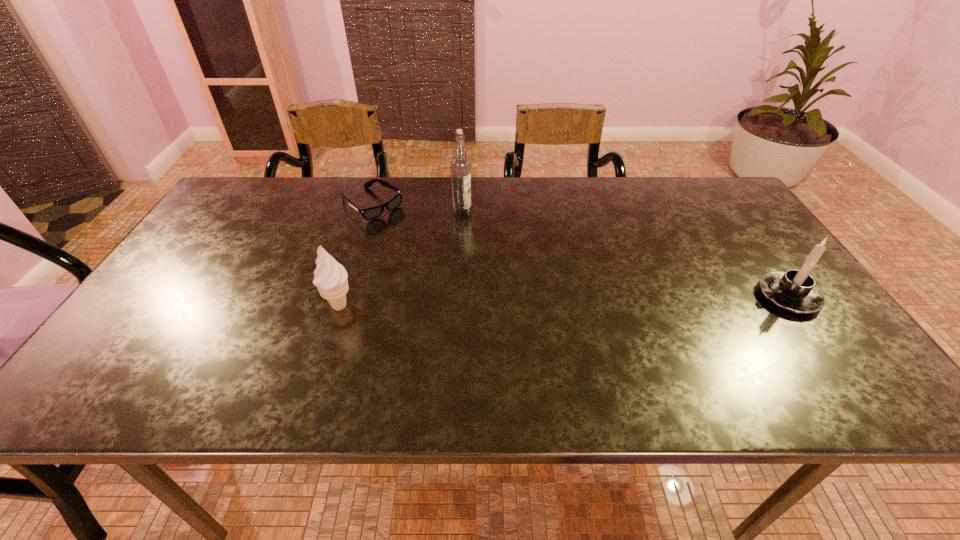
The width and height of the screenshot is (960, 540). Identify the location of free space that is in between the sunglasses and the icecream. (355, 255).

Where is `free spot between the vodka and the rightmost object`? free spot between the vodka and the rightmost object is located at coordinates (625, 255).

You are a GUI agent. You are given a task and a screenshot of the screen. Output one action in this format:
    pyautogui.click(x=<x>, y=<y>)
    Task: Click on the vacant area between the rightmost object and the tallest object
    
    Given the screenshot: What is the action you would take?
    pyautogui.click(x=625, y=255)

Locate an element on the screen. This screenshot has width=960, height=540. object that is the second closest to the vodka is located at coordinates (331, 277).

Locate which object is the second closest to the sunglasses. Please provide its 2D coordinates. Your answer should be formatted as a tuple, i.e. [(x, y)], where the tuple contains the x and y coordinates of a point satisfying the conditions above.

[(331, 277)]

You are a GUI agent. You are given a task and a screenshot of the screen. Output one action in this format:
    pyautogui.click(x=<x>, y=<y>)
    Task: Click on the blank space that satisfies the following two spatial constraints: 1. on the front side of the rightmost object; 2. with a handle on the side of the third object from left to right
    This screenshot has height=540, width=960.
    Given the screenshot: What is the action you would take?
    pyautogui.click(x=458, y=296)

I want to click on vacant area in the image that satisfies the following two spatial constraints: 1. on the front side of the sunglasses; 2. on the left side of the vodka, so click(x=369, y=213).

Identify the location of free region that satisfies the following two spatial constraints: 1. on the front side of the vodka; 2. with a handle on the side of the rightmost object. Image resolution: width=960 pixels, height=540 pixels. (458, 296).